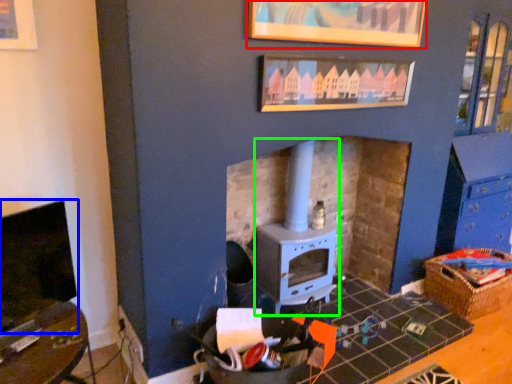
Question: Estimate the real-world distances between objects in this image. Which object is farther from picture frame (highlighted by a red box), fireplace (highlighted by a blue box) or wood burning stove (highlighted by a green box)?

Choices:
 (A) fireplace
 (B) wood burning stove

Answer: (A)